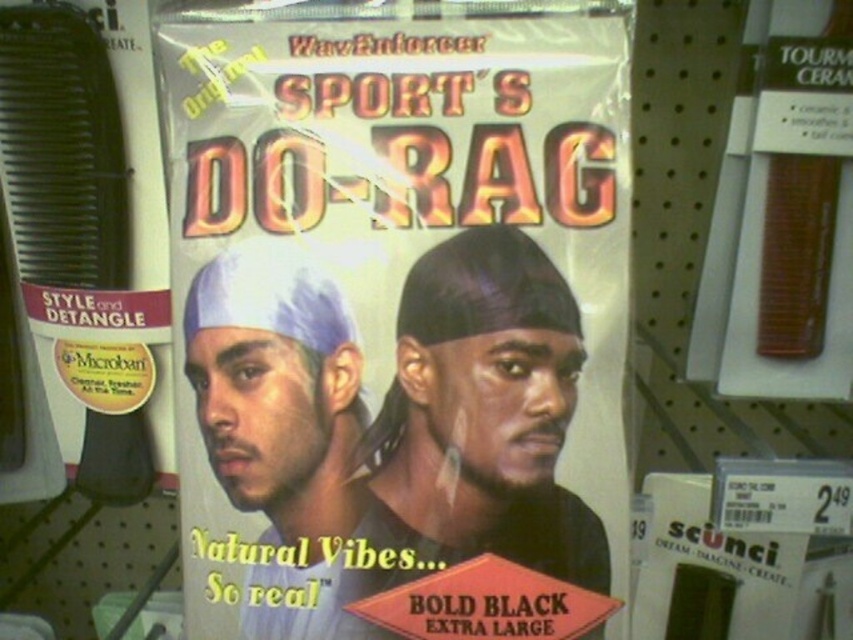
Between bold black fabric do-rag at center and matte blue bandana at center, which one is positioned lower?

Positioned lower is matte blue bandana at center.

Is point (219, 204) farther from camera compared to point (230, 384)?

Yes.

The height and width of the screenshot is (640, 853). I want to click on bold black fabric do-rag at center, so click(399, 323).

Can you confirm if bold black fabric do-rag at center is taller than matte black do-rag at center?

Yes, bold black fabric do-rag at center is taller than matte black do-rag at center.

Is point (285, 458) behind point (558, 486)?

No, (285, 458) is closer to viewer.

Locate an element on the screen. The image size is (853, 640). bold black fabric do-rag at center is located at coordinates (399, 323).

Is point (488, 321) farther from viewer compared to point (271, 312)?

No, (488, 321) is closer to viewer.

Does matte black do-rag at center appear under matte blue bandana at center?

Indeed, matte black do-rag at center is positioned under matte blue bandana at center.

Between point (469, 444) and point (312, 294), which one is positioned behind?

Point (312, 294)

What are the coordinates of `matte black do-rag at center` in the screenshot? It's located at (480, 419).